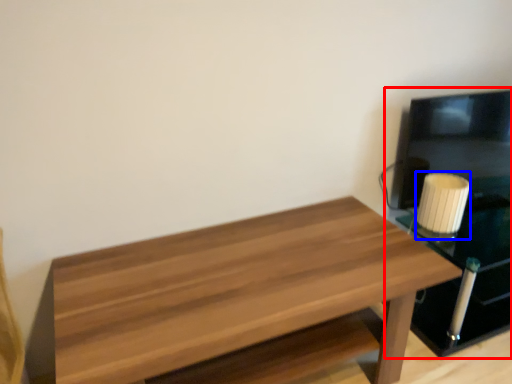
Question: Among these objects, which one is nearest to the camera, entertainment center (highlighted by a red box) or candle holder (highlighted by a blue box)?

Choices:
 (A) entertainment center
 (B) candle holder

Answer: (A)